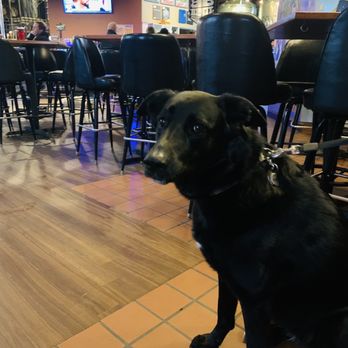
At what (x,y) coordinates should I click in order to perform the action: click on floor. Please return your answer as a coordinate pair (x, y). Looking at the image, I should click on (114, 260).